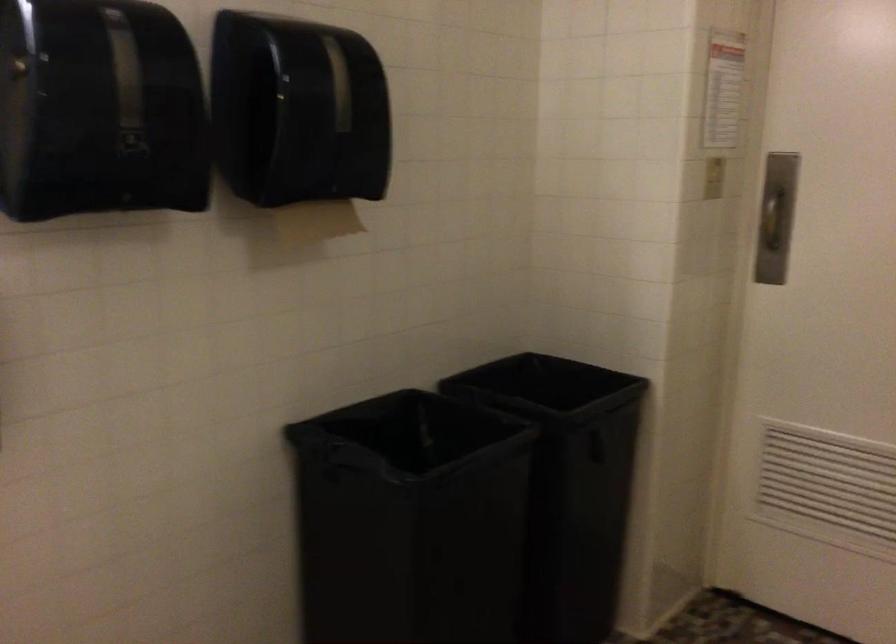
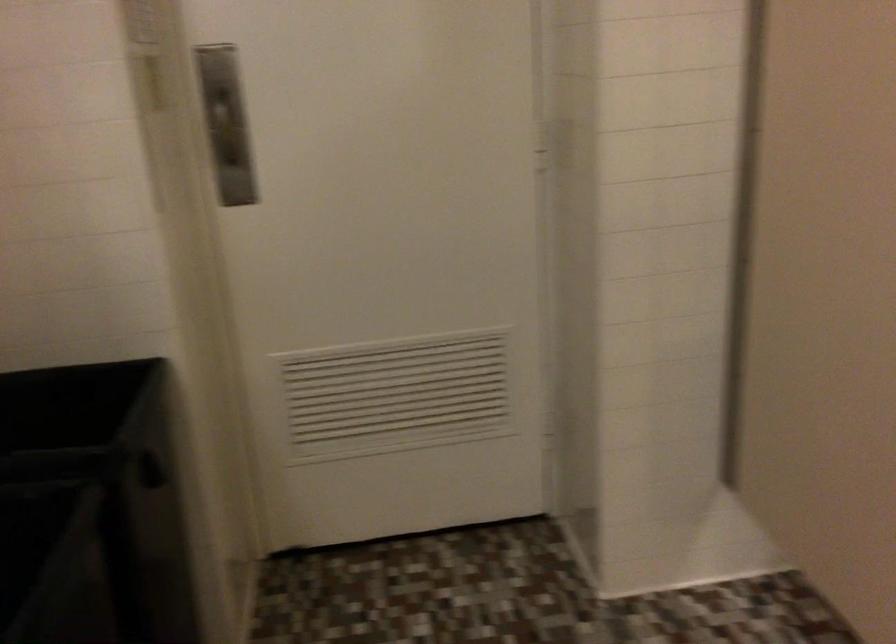
Question: Based on the continuous images, in which direction is the camera rotating? Reply with the corresponding letter.

Choices:
 (A) Left
 (B) Right
 (C) Up
 (D) Down

Answer: (B)